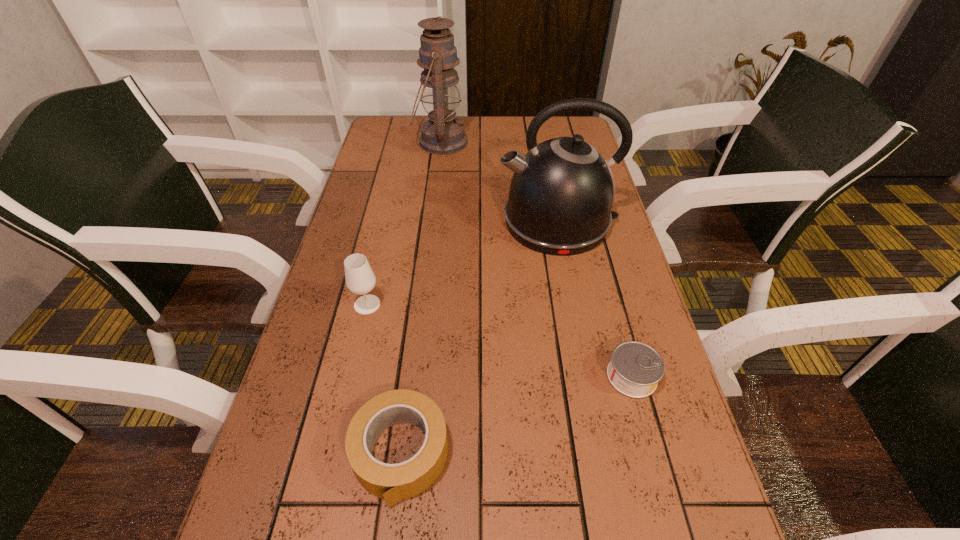
Where is `empty space that is in between the second nearest object and the duct tape`? The image size is (960, 540). empty space that is in between the second nearest object and the duct tape is located at coordinates (516, 415).

Locate an element on the screen. Image resolution: width=960 pixels, height=540 pixels. empty space that is in between the oil lamp and the kettle is located at coordinates (499, 182).

The width and height of the screenshot is (960, 540). I want to click on vacant area that lies between the can and the farthest object, so click(537, 259).

Locate an element on the screen. free space that is in between the third shortest object and the nearest object is located at coordinates (384, 379).

Where is `vacant region between the fourth nearest object and the farthest object`? The height and width of the screenshot is (540, 960). vacant region between the fourth nearest object and the farthest object is located at coordinates (499, 182).

Identify which object is the fourth nearest to the oil lamp. Please provide its 2D coordinates. Your answer should be formatted as a tuple, i.e. [(x, y)], where the tuple contains the x and y coordinates of a point satisfying the conditions above.

[(392, 482)]

I want to click on object that is the third nearest to the shortest object, so click(360, 279).

Find the location of a particular element. The width and height of the screenshot is (960, 540). vacant space that satisfies the following two spatial constraints: 1. on the front side of the glass; 2. on the left side of the fourth farthest object is located at coordinates (350, 376).

I want to click on free spot that satisfies the following two spatial constraints: 1. on the spout of the kettle; 2. on the back side of the shortest object, so click(587, 376).

Identify the location of free region that satisfies the following two spatial constraints: 1. on the spout of the kettle; 2. on the right side of the can. The height and width of the screenshot is (540, 960). (587, 376).